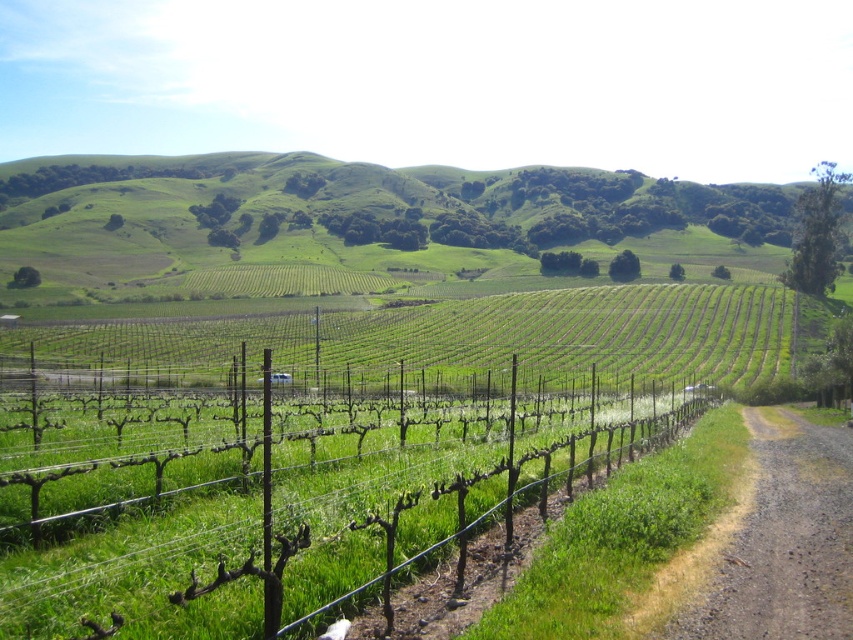
You are a hiker standing at the edge of the vineyard and want to reach the rolling hills in the background. You see a wire mesh fence at center and a brown gravel path at lower right. Which object should you avoid stepping on to stay on the designated path?

You should avoid stepping on the brown gravel path at lower right because the wire mesh fence at center is below it, meaning the path is elevated and the fence is lower, so staying on the path keeps you on the designated route.

In the scene shown: You are a hiker who has just arrived at the vineyard and wants to take a photo of the wire mesh fence at center and the brown gravel path at lower right. To get the best shot, you need to know which object is closer to the camera. Can you determine which one is positioned to the left side from your perspective?

The wire mesh fence at center is positioned on the left side of brown gravel path at lower right, so from your perspective, the wire mesh fence at center is closer to the left side compared to the brown gravel path at lower right.